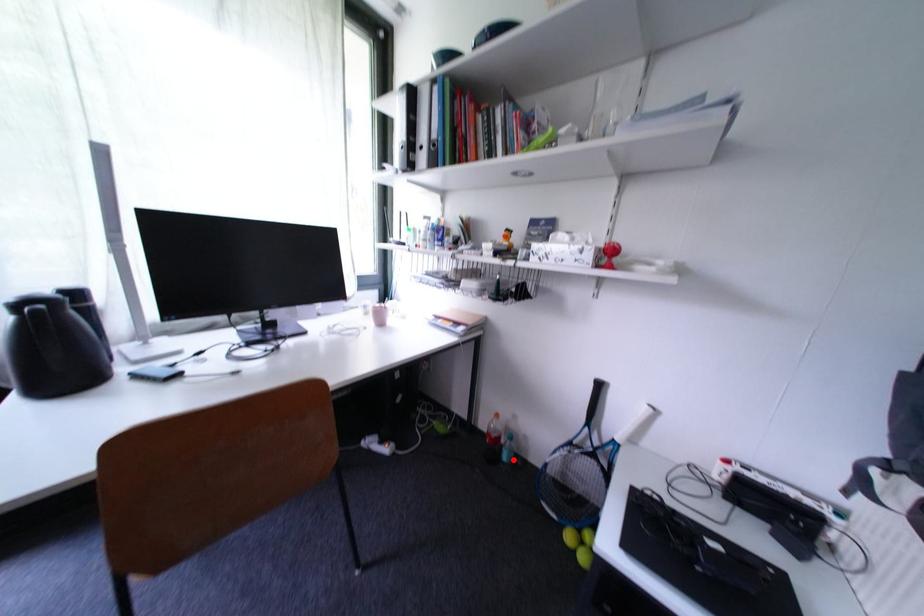
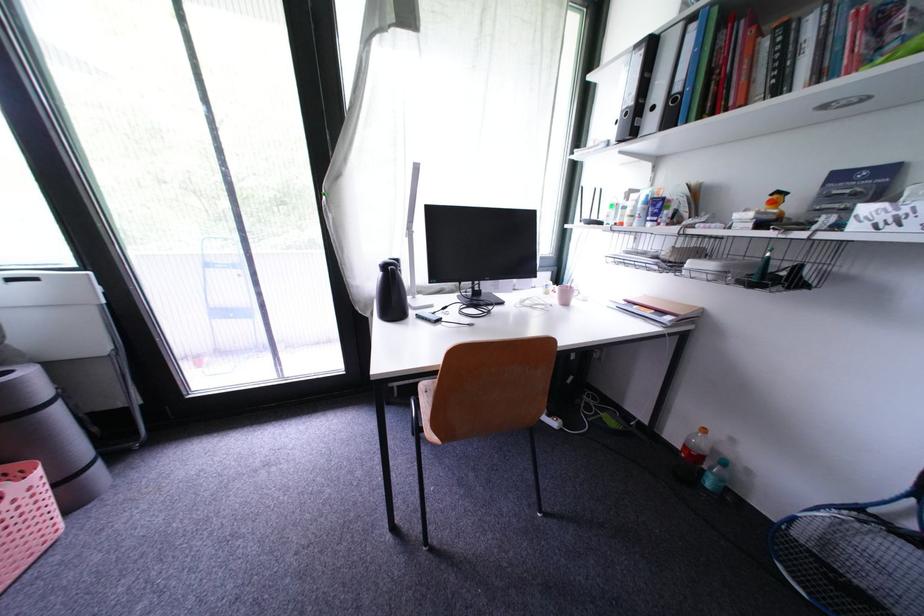
Question: I am providing you with two images of the same scene from different viewpoints. Given a red point in image1, look at the same physical point in image2. Is it:

Choices:
 (A) Closer to the viewpoint
 (B) Farther from the viewpoint

Answer: (A)